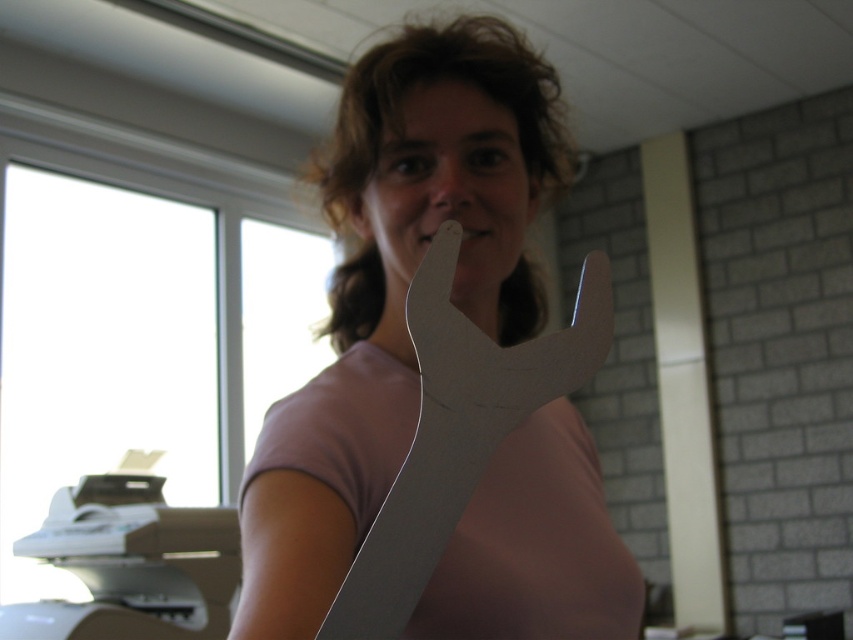
Question: Is metallic silver wrench at center further to the viewer compared to pink matte tongue at center?

Choices:
 (A) no
 (B) yes

Answer: (A)

Question: Which object appears farthest from the camera in this image?

Choices:
 (A) metallic silver wrench at center
 (B) matte white wrench at center
 (C) white cardboard knife at center
 (D) pink matte tongue at center

Answer: (D)

Question: Is matte white wrench at center below metallic silver wrench at center?

Choices:
 (A) yes
 (B) no

Answer: (B)

Question: Based on their relative distances, which object is farther from the metallic silver wrench at center?

Choices:
 (A) matte white wrench at center
 (B) pink matte tongue at center

Answer: (B)

Question: Among these points, which one is nearest to the camera?

Choices:
 (A) (573, 353)
 (B) (425, 449)
 (C) (485, 230)
 (D) (260, 554)

Answer: (B)

Question: Is matte white wrench at center positioned behind white cardboard knife at center?

Choices:
 (A) yes
 (B) no

Answer: (A)